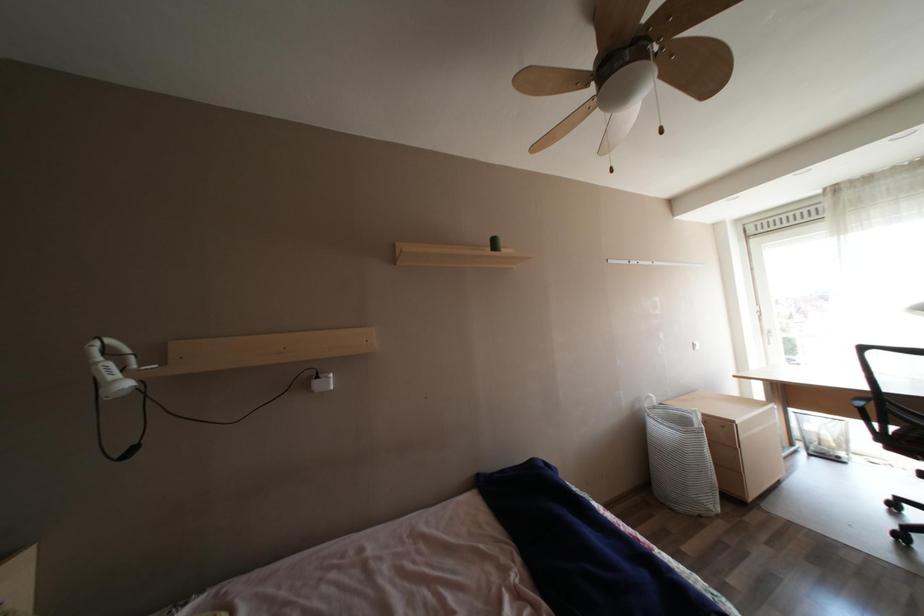
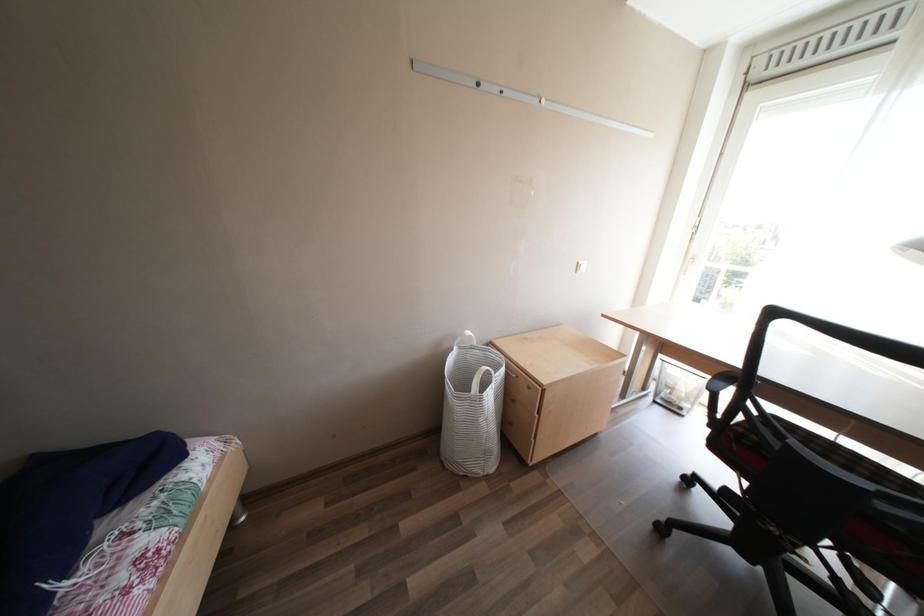
The images are taken continuously from a first-person perspective. In which direction are you moving?

The cameraman walked toward right, forward.